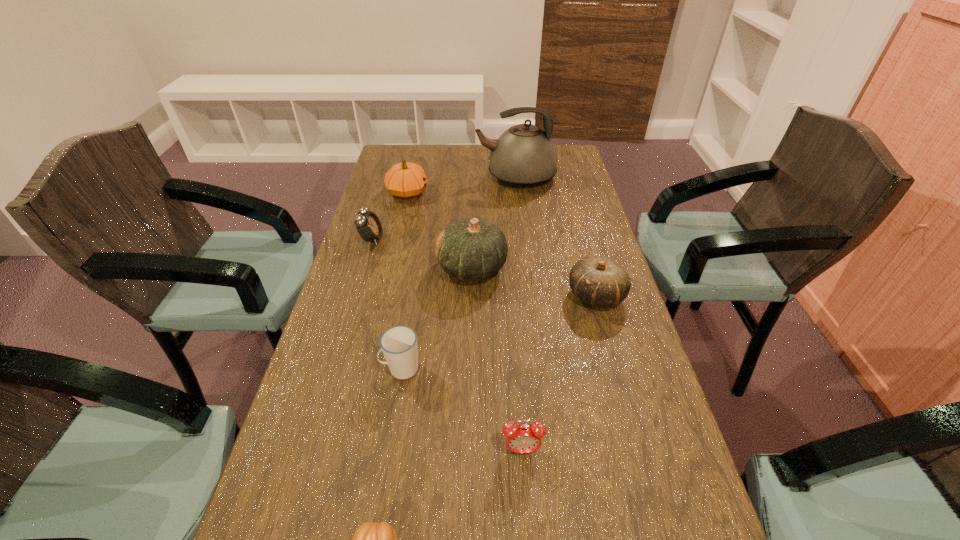
At what (x,y) coordinates should I click in order to perform the action: click on kettle. Please return your answer as a coordinate pair (x, y). This screenshot has width=960, height=540. Looking at the image, I should click on (524, 156).

The height and width of the screenshot is (540, 960). I want to click on the tallest gourd, so click(470, 249).

Identify the location of the farthest gourd. The width and height of the screenshot is (960, 540). (406, 180).

Where is `the rightmost gourd`? This screenshot has width=960, height=540. the rightmost gourd is located at coordinates (597, 280).

Image resolution: width=960 pixels, height=540 pixels. Identify the location of the farther alarm clock. [x=369, y=227].

Locate an element on the screen. the nearer alarm clock is located at coordinates (520, 438).

The height and width of the screenshot is (540, 960). I want to click on the second nearest object, so [x=520, y=438].

I want to click on cup, so [x=399, y=343].

What are the coordinates of `vacant area located 0.190m at the spout of the kettle` in the screenshot? It's located at (422, 177).

Find the location of `vacant space located 0.280m at the spout of the kettle`. vacant space located 0.280m at the spout of the kettle is located at coordinates (398, 177).